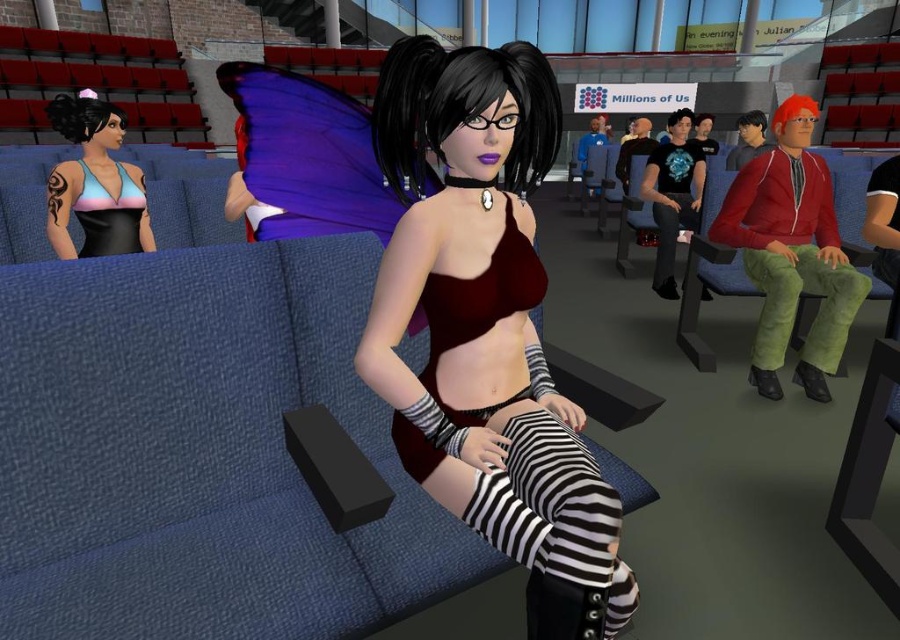
From the picture: You are a fashion designer observing the scene. You notice the velvet maroon top at center and the green fuzzy pants at right. Which clothing item appears taller in the image?

The velvet maroon top at center is taller than the green fuzzy pants at right.

You are standing in the virtual environment and see the central character wearing a dark red crop top. There is also a point marked at coordinates (94, 182). What object is located at that point?

The matte black bikini top at left is located at point (94, 182).

You are standing in the virtual environment and want to sit down. The blue fabric couch at center and the pastel rainbow fabric dress at left are both in your view. Which object is lower to the ground and suitable for sitting?

The blue fabric couch at center is located below the pastel rainbow fabric dress at left, so it is lower to the ground and suitable for sitting.